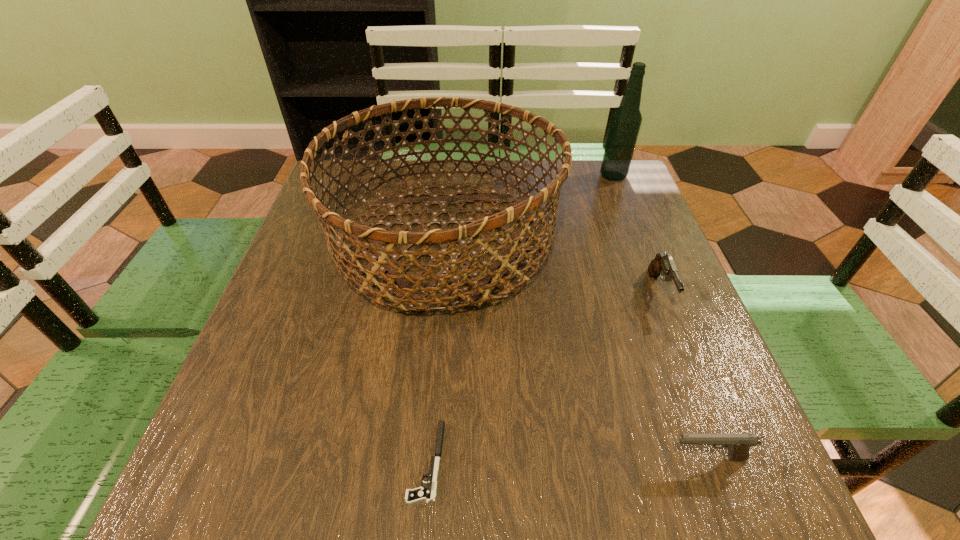
Find the location of a particular element. This screenshot has height=540, width=960. the tallest object is located at coordinates (626, 120).

Image resolution: width=960 pixels, height=540 pixels. Find the location of `basket`. basket is located at coordinates (411, 291).

Locate an element on the screen. the farthest pistol is located at coordinates (663, 264).

Locate an element on the screen. the second shortest object is located at coordinates (738, 445).

The width and height of the screenshot is (960, 540). I want to click on the leftmost pistol, so tap(427, 493).

This screenshot has height=540, width=960. Identify the location of the shortest pistol. (427, 493).

Locate an element on the screen. vacant space situated on the left of the tallest object is located at coordinates (582, 176).

The height and width of the screenshot is (540, 960). What are the coordinates of `vacant space located on the right of the basket` in the screenshot? It's located at (625, 238).

You are a GUI agent. You are given a task and a screenshot of the screen. Output one action in this format:
    pyautogui.click(x=<x>, y=<y>)
    Task: Click on the blank space located 0.300m at the barrel of the farthest pistol
    
    Given the screenshot: What is the action you would take?
    pyautogui.click(x=729, y=465)

In order to click on vacant space located 0.110m at the barrel of the second shortest object in this screenshot , I will do click(598, 458).